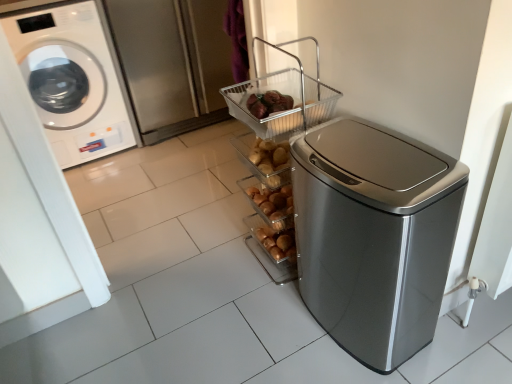
Question: From the image's perspective, does satin silver trash can at right appear higher than brushed metal screen door at upper left?

Choices:
 (A) yes
 (B) no

Answer: (B)

Question: Considering the relative positions of satin silver trash can at right and brushed metal screen door at upper left in the image provided, is satin silver trash can at right to the left of brushed metal screen door at upper left from the viewer's perspective?

Choices:
 (A) yes
 (B) no

Answer: (B)

Question: Is brushed metal screen door at upper left completely or partially inside satin silver trash can at right?

Choices:
 (A) yes
 (B) no

Answer: (B)

Question: From a real-world perspective, does satin silver trash can at right sit lower than brushed metal screen door at upper left?

Choices:
 (A) no
 (B) yes

Answer: (B)

Question: Can you confirm if satin silver trash can at right is shorter than brushed metal screen door at upper left?

Choices:
 (A) yes
 (B) no

Answer: (A)

Question: Based on their sizes in the image, would you say white glossy washing machine at left is bigger or smaller than metallic wire basket at upper center?

Choices:
 (A) big
 (B) small

Answer: (A)

Question: From a real-world perspective, is white glossy washing machine at left above or below metallic wire basket at upper center?

Choices:
 (A) above
 (B) below

Answer: (B)

Question: Is white glossy washing machine at left taller or shorter than metallic wire basket at upper center?

Choices:
 (A) short
 (B) tall

Answer: (B)

Question: Would you say white glossy washing machine at left is inside or outside metallic wire basket at upper center?

Choices:
 (A) outside
 (B) inside

Answer: (A)

Question: From the image's perspective, is white glossy washing machine at left located above or below brushed metal screen door at upper left?

Choices:
 (A) above
 (B) below

Answer: (B)

Question: From a real-world perspective, is white glossy washing machine at left positioned above or below brushed metal screen door at upper left?

Choices:
 (A) below
 (B) above

Answer: (B)

Question: Is white glossy washing machine at left to the left or to the right of brushed metal screen door at upper left in the image?

Choices:
 (A) right
 (B) left

Answer: (B)

Question: In terms of width, does white glossy washing machine at left look wider or thinner when compared to brushed metal screen door at upper left?

Choices:
 (A) thin
 (B) wide

Answer: (B)

Question: From a real-world perspective, is brushed metal screen door at upper left physically located above or below metallic wire basket at upper center?

Choices:
 (A) below
 (B) above

Answer: (A)

Question: Is brushed metal screen door at upper left in front of or behind metallic wire basket at upper center in the image?

Choices:
 (A) behind
 (B) front

Answer: (A)